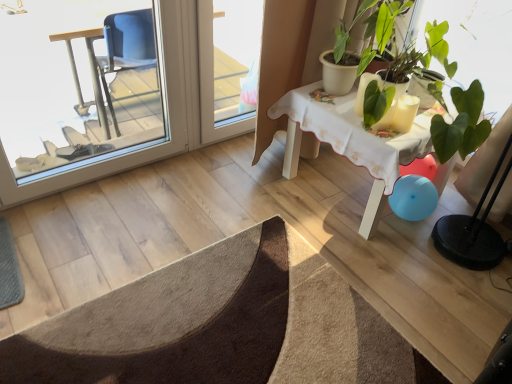
Question: Considering the relative sizes of brown textured doormat at lower left and transparent glass screen door at left, placed as the second screen door when sorted from right to left, in the image provided, is brown textured doormat at lower left smaller than transparent glass screen door at left, placed as the second screen door when sorted from right to left,?

Choices:
 (A) yes
 (B) no

Answer: (B)

Question: Is brown textured doormat at lower left at the right side of transparent glass screen door at left, placed as the second screen door when sorted from right to left?

Choices:
 (A) no
 (B) yes

Answer: (B)

Question: From the image's perspective, is brown textured doormat at lower left below transparent glass screen door at left, which is the first screen door from left to right?

Choices:
 (A) no
 (B) yes

Answer: (B)

Question: Can transparent glass screen door at left, placed as the second screen door when sorted from right to left, be found inside brown textured doormat at lower left?

Choices:
 (A) no
 (B) yes

Answer: (A)

Question: Considering the relative sizes of brown textured doormat at lower left and transparent glass screen door at left, which is the first screen door from left to right, in the image provided, is brown textured doormat at lower left thinner than transparent glass screen door at left, which is the first screen door from left to right,?

Choices:
 (A) yes
 (B) no

Answer: (B)

Question: Considering the relative positions of brown textured doormat at lower left and transparent glass screen door at left, which is the first screen door from left to right, in the image provided, is brown textured doormat at lower left in front of transparent glass screen door at left, which is the first screen door from left to right,?

Choices:
 (A) no
 (B) yes

Answer: (B)

Question: Is white wooden table at upper right completely or partially inside transparent plastic screen door at upper center, which ranks as the 2th screen door in left-to-right order?

Choices:
 (A) no
 (B) yes

Answer: (A)

Question: Is the depth of transparent plastic screen door at upper center, which ranks as the 2th screen door in left-to-right order, less than that of white wooden table at upper right?

Choices:
 (A) yes
 (B) no

Answer: (B)

Question: Is transparent plastic screen door at upper center, which ranks as the 2th screen door in left-to-right order, not near white wooden table at upper right?

Choices:
 (A) yes
 (B) no

Answer: (B)

Question: From the image's perspective, is transparent plastic screen door at upper center, which ranks as the 2th screen door in left-to-right order, beneath white wooden table at upper right?

Choices:
 (A) no
 (B) yes

Answer: (A)

Question: From a real-world perspective, is transparent plastic screen door at upper center, marked as the 1th screen door in a right-to-left arrangement, beneath white wooden table at upper right?

Choices:
 (A) no
 (B) yes

Answer: (A)

Question: From a real-world perspective, is transparent plastic screen door at upper center, marked as the 1th screen door in a right-to-left arrangement, physically above white wooden table at upper right?

Choices:
 (A) no
 (B) yes

Answer: (B)

Question: From a real-world perspective, is white wooden table at upper right positioned over transparent plastic screen door at upper center, which ranks as the 2th screen door in left-to-right order, based on gravity?

Choices:
 (A) yes
 (B) no

Answer: (B)